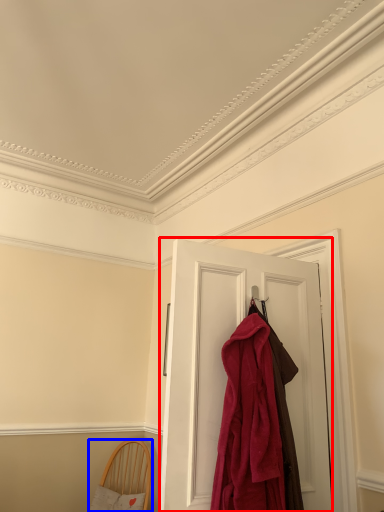
Question: Among these objects, which one is farthest to the camera, door (highlighted by a red box) or furniture (highlighted by a blue box)?

Choices:
 (A) door
 (B) furniture

Answer: (B)